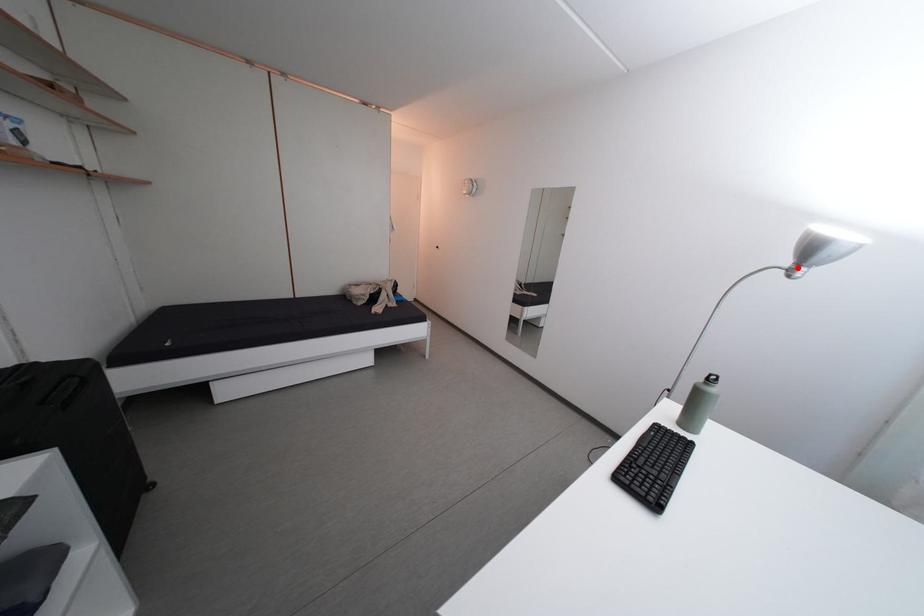
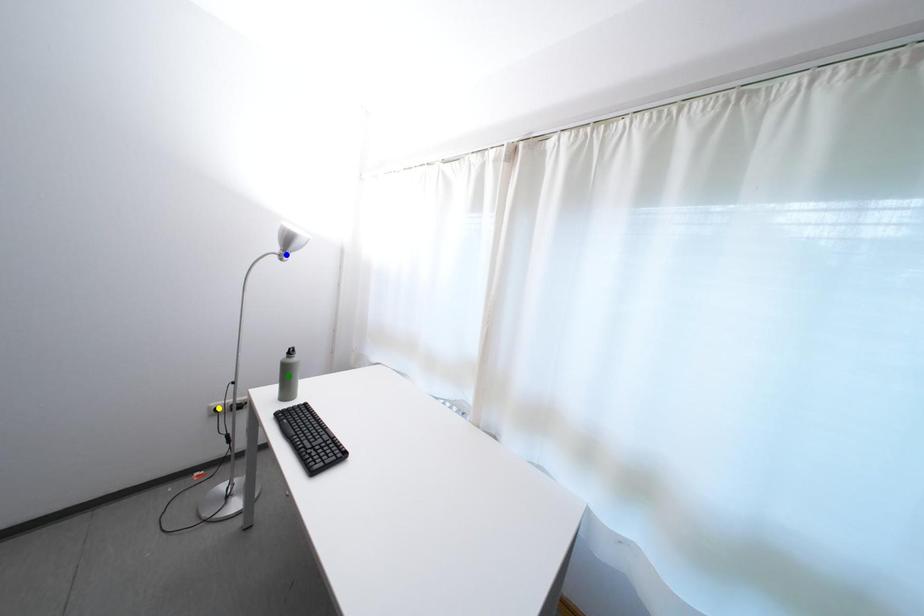
Question: I am providing you with two images of the same scene from different viewpoints. A red point is marked on the first image. You are given multiple points on the second image. Which spot in image 2 lines up with the point in image 1?

Choices:
 (A) green point
 (B) yellow point
 (C) blue point

Answer: (C)